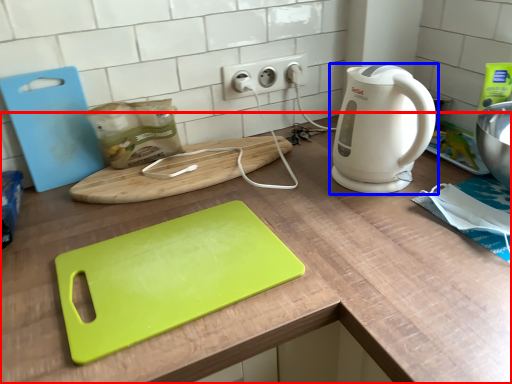
Question: Which of the following is the closest to the observer, counter (highlighted by a red box) or home appliance (highlighted by a blue box)?

Choices:
 (A) counter
 (B) home appliance

Answer: (A)